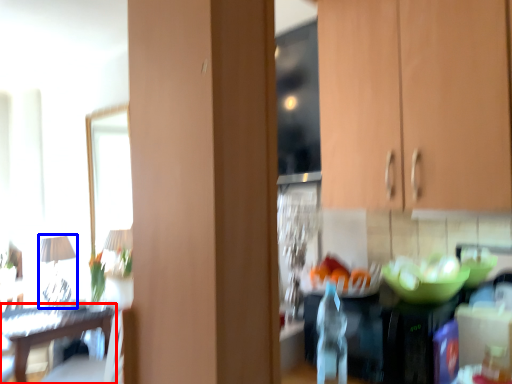
Question: Which of the following is the closest to the observer, table (highlighted by a red box) or lamp (highlighted by a blue box)?

Choices:
 (A) table
 (B) lamp

Answer: (A)